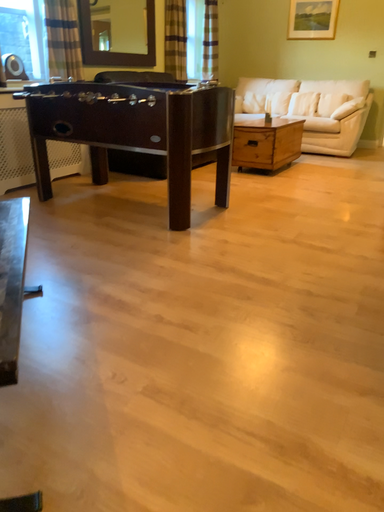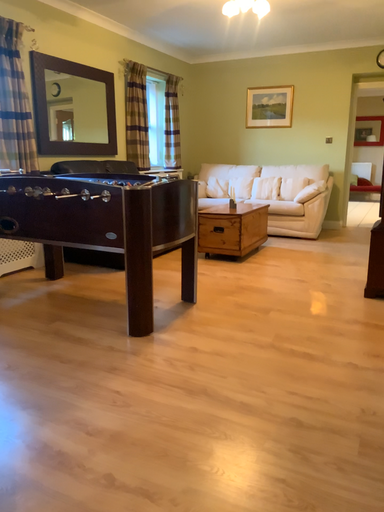
Question: How did the camera likely rotate when shooting the video?

Choices:
 (A) rotated downward
 (B) rotated upward

Answer: (B)